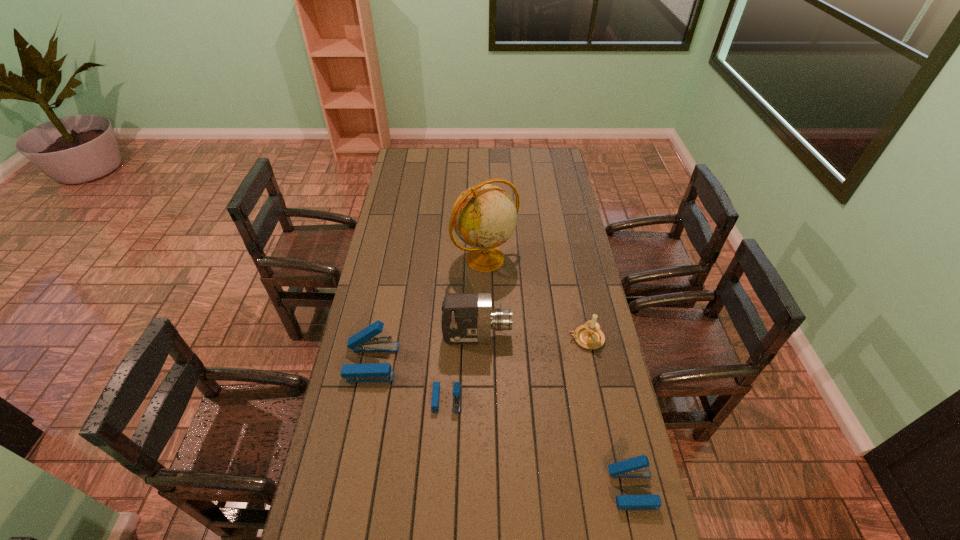
I want to click on free location that satisfies the following two spatial constraints: 1. with a handle on the side of the candle holder; 2. on the front side of the fifth farthest object, so click(598, 399).